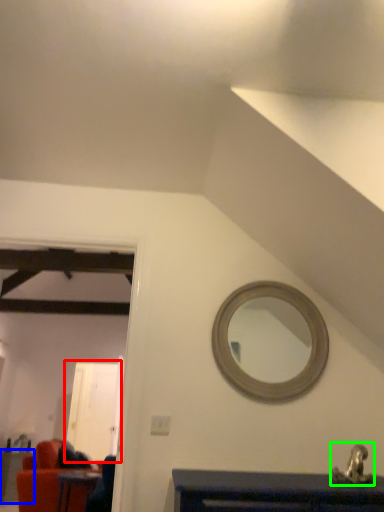
Question: Considering the real-world distances, which object is closest to glass door (highlighted by a red box)? table (highlighted by a blue box) or sink (highlighted by a green box).

Choices:
 (A) table
 (B) sink

Answer: (A)